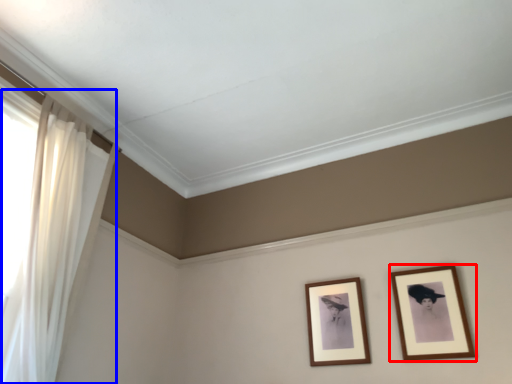
Question: Which point is closer to the camera, picture frame (highlighted by a red box) or curtain (highlighted by a blue box)?

Choices:
 (A) picture frame
 (B) curtain

Answer: (B)